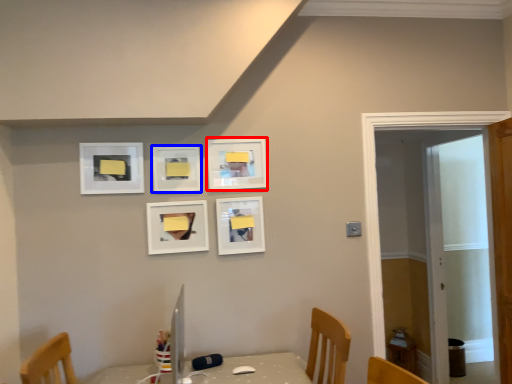
Question: Among these objects, which one is farthest to the camera, picture frame (highlighted by a red box) or picture frame (highlighted by a blue box)?

Choices:
 (A) picture frame
 (B) picture frame

Answer: (A)